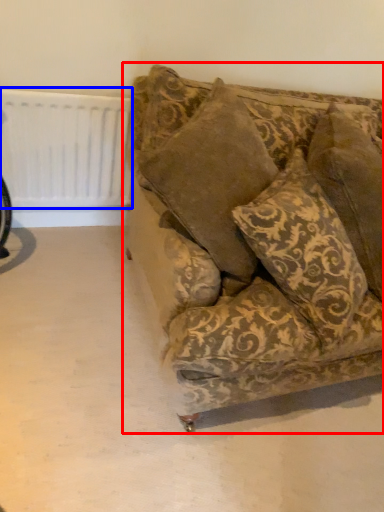
Question: Which of the following is the farthest to the observer, studio couch (highlighted by a red box) or radiator (highlighted by a blue box)?

Choices:
 (A) studio couch
 (B) radiator

Answer: (B)